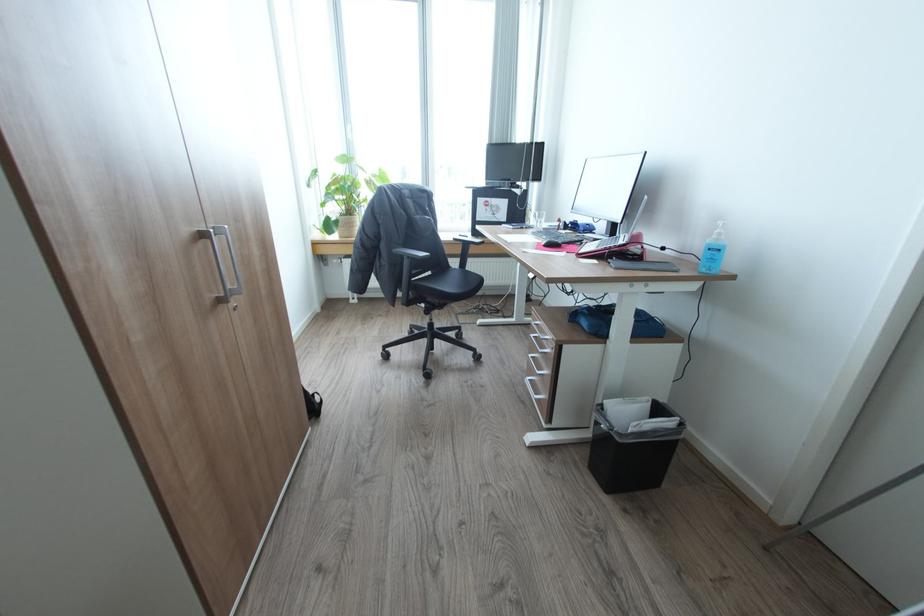
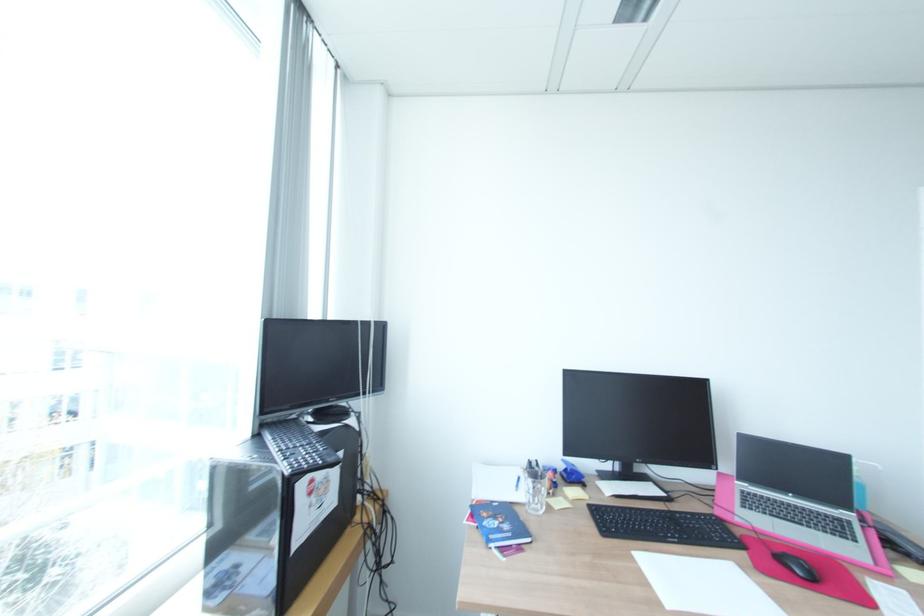
Where in the second image is the point corresponding to the point at 550,236 from the first image?

(681, 541)